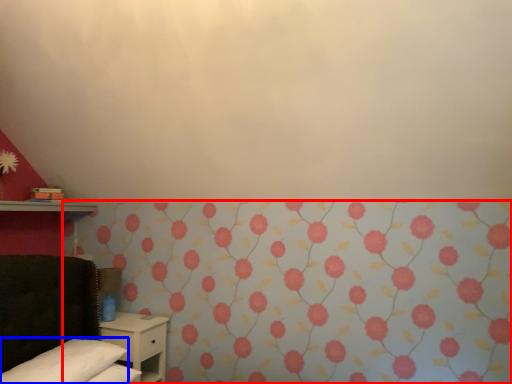
Question: Which object is further to the camera taking this photo, curtain (highlighted by a red box) or pillow (highlighted by a blue box)?

Choices:
 (A) curtain
 (B) pillow

Answer: (B)